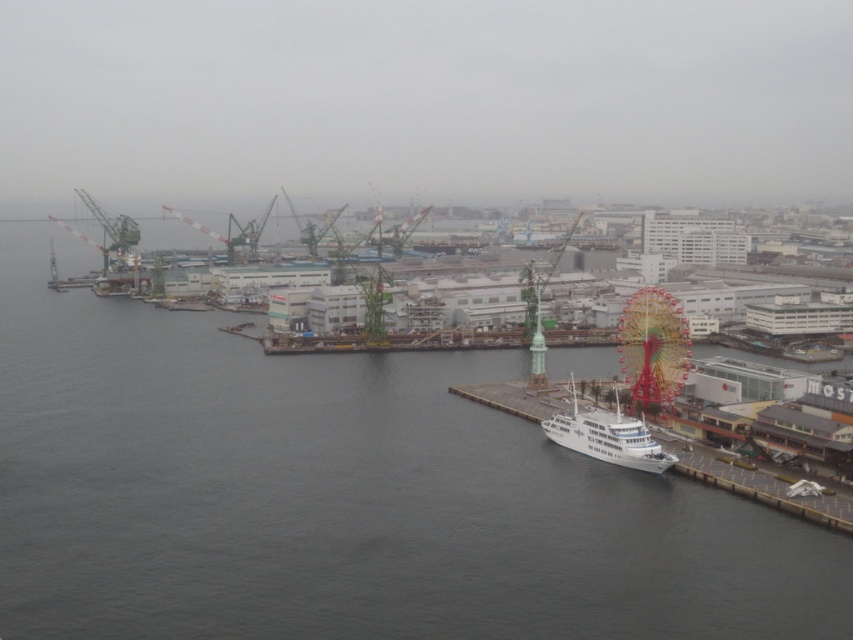
You are a delivery drone that needs to fly from the gray water at lower left to the white glossy ship at lower right. The drone has a maximum flight range of 40 meters. Can it reach the ship without recharging?

The gray water at lower left is 40.85 meters from the white glossy ship at lower right. Since the distance is slightly over the drone maximum flight range of 40 meters, the drone cannot reach the ship without recharging.

You are a delivery drone flying over the port area. You need to land on the white glossy ship at lower right but must avoid the gray water at lower left. Based on the scene, which area is wider and requires more caution to avoid?

The gray water at lower left might be wider than the white glossy ship at lower right, so you should exercise more caution to avoid the gray water at lower left as it spans a larger area.

You are a photographer standing at the port and want to capture both point (711, 472) and point (647, 467) in your photo. Which point should you focus on first to ensure both are in focus?

You should focus on point (647, 467) first because it is closer to you than point (711, 472), which is further away. By focusing on the closer point, the depth of field may help keep both points in focus.